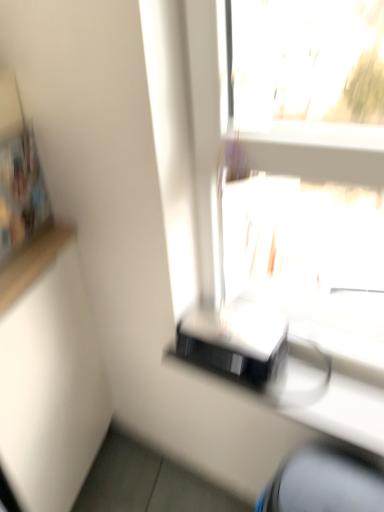
Question: From their relative heights in the image, would you say blue fabric computer chair at lower right is taller or shorter than black glossy printer at lower right?

Choices:
 (A) short
 (B) tall

Answer: (B)

Question: Is point (377, 477) positioned closer to the camera than point (374, 431)?

Choices:
 (A) farther
 (B) closer

Answer: (B)

Question: Visually, is blue fabric computer chair at lower right positioned to the left or to the right of black glossy printer at lower right?

Choices:
 (A) right
 (B) left

Answer: (A)

Question: Is black glossy printer at lower right inside the boundaries of blue fabric computer chair at lower right, or outside?

Choices:
 (A) outside
 (B) inside

Answer: (A)

Question: From a real-world perspective, relative to blue fabric computer chair at lower right, is black glossy printer at lower right vertically above or below?

Choices:
 (A) below
 (B) above

Answer: (B)

Question: Looking at their shapes, would you say black glossy printer at lower right is wider or thinner than blue fabric computer chair at lower right?

Choices:
 (A) wide
 (B) thin

Answer: (B)

Question: Considering the positions of black glossy printer at lower right and blue fabric computer chair at lower right in the image, is black glossy printer at lower right taller or shorter than blue fabric computer chair at lower right?

Choices:
 (A) short
 (B) tall

Answer: (A)